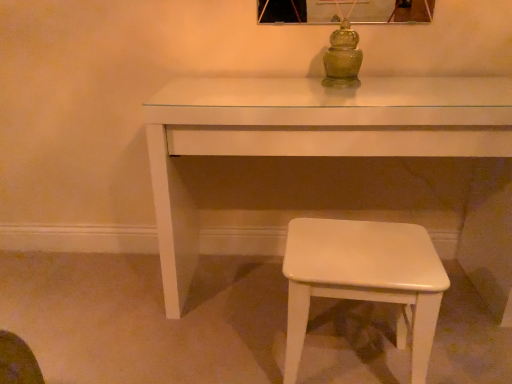
Question: Is white glossy stool at lower right inside the boundaries of white glossy table at center, or outside?

Choices:
 (A) inside
 (B) outside

Answer: (B)

Question: Based on their positions, is white glossy stool at lower right located to the left or right of white glossy table at center?

Choices:
 (A) left
 (B) right

Answer: (B)

Question: Considering the real-world distances, which object is farthest from the green glass jar at center?

Choices:
 (A) white glossy table at center
 (B) white glossy stool at lower right

Answer: (B)

Question: Which of these objects is positioned closest to the white glossy stool at lower right?

Choices:
 (A) green glass jar at center
 (B) white glossy table at center

Answer: (B)